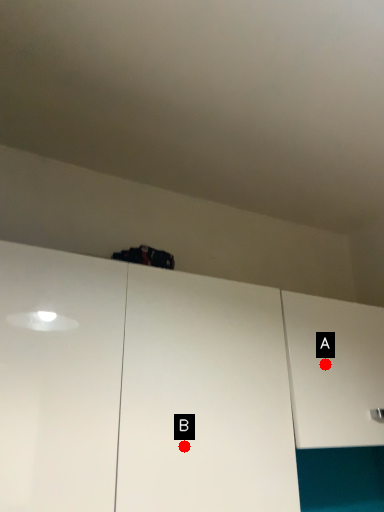
Question: Two points are circled on the image, labeled by A and B beside each circle. Which point is farther to the camera?

Choices:
 (A) A is further
 (B) B is further

Answer: (A)